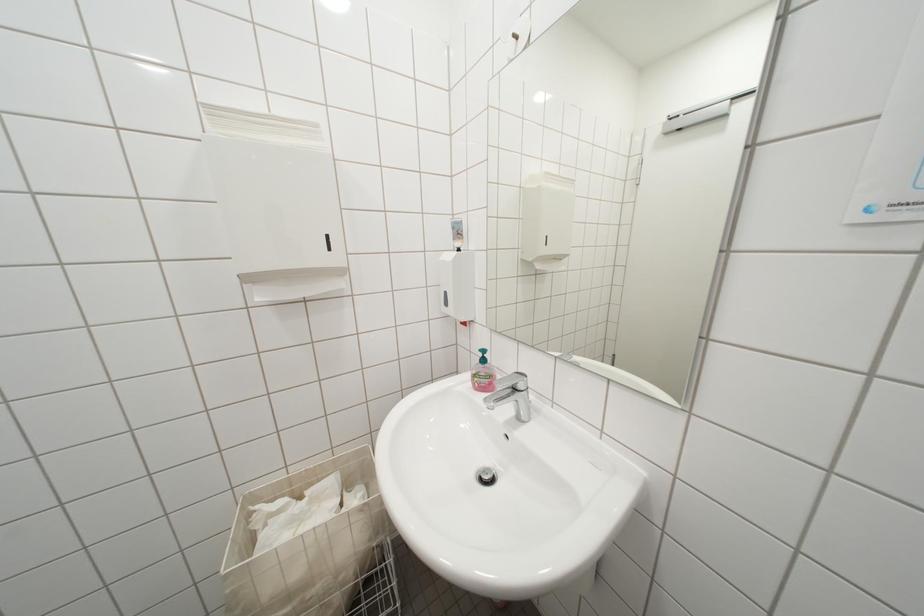
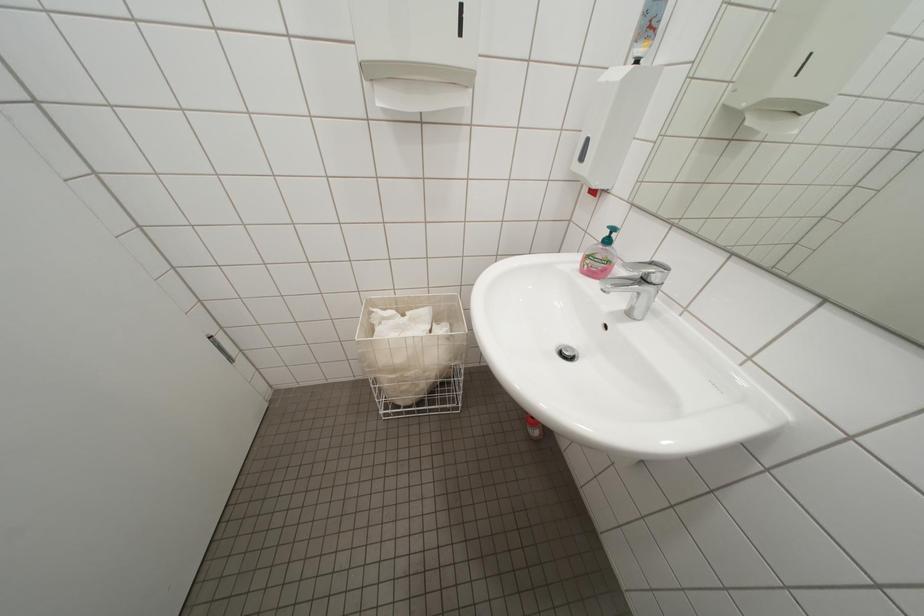
The first image is from the beginning of the video and the second image is from the end. How did the camera likely rotate when shooting the video?

The rotation direction of the camera is left-down.